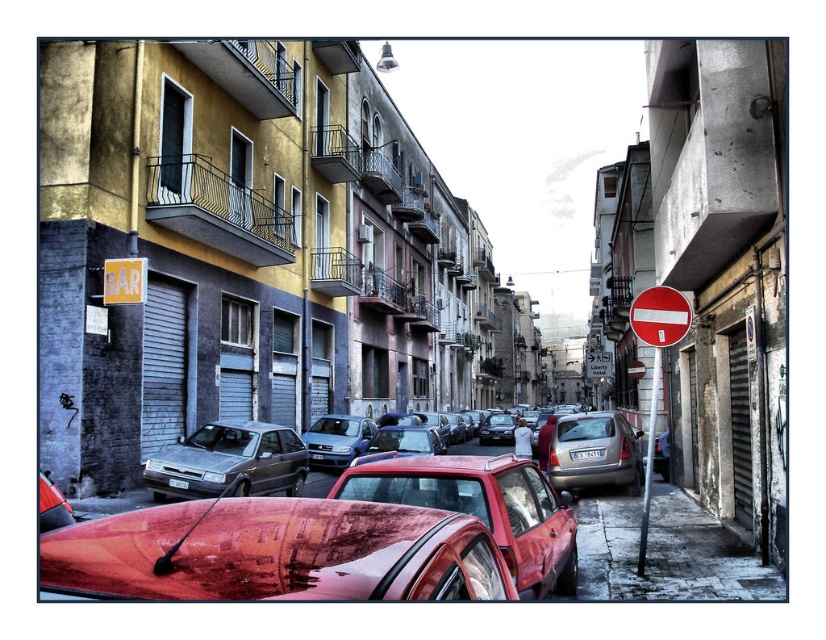
You are a driver approaching the intersection and see the red plastic sign at right and the red glossy stop sign at right. Which one is larger in size?

The red plastic sign at right is bigger than the red glossy stop sign at right.

You are a delivery driver trying to navigate through the narrow street. There is a red plastic sign at right. Can you see the point at coordinates (x=656, y=368) on the red plastic sign at right from your current position?

The point at coordinates (x=656, y=368) is on the red plastic sign at right, so yes, you can see it from your current position.